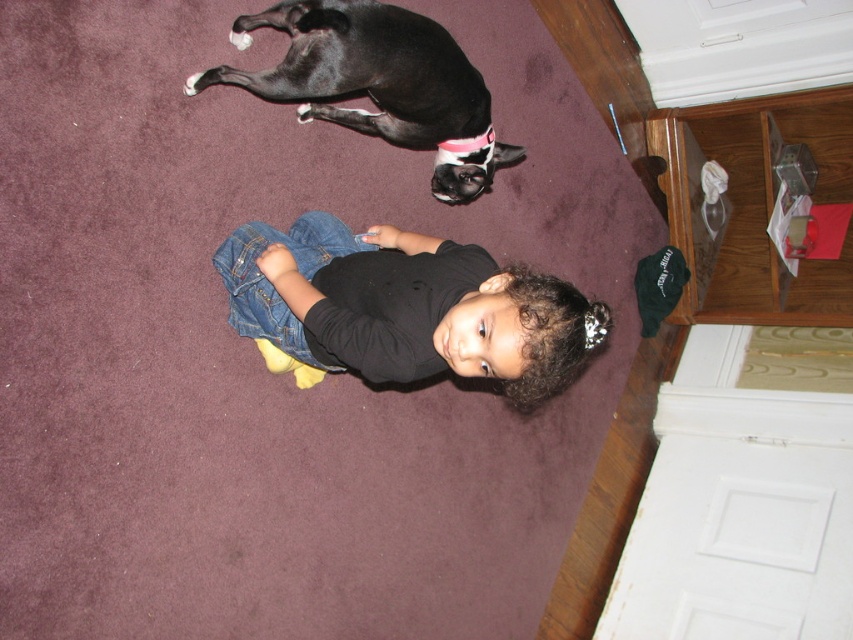
Is denim jeans at center to the left of black matte dog at upper center from the viewer's perspective?

Incorrect, denim jeans at center is not on the left side of black matte dog at upper center.

Locate an element on the screen. Image resolution: width=853 pixels, height=640 pixels. denim jeans at center is located at coordinates (404, 308).